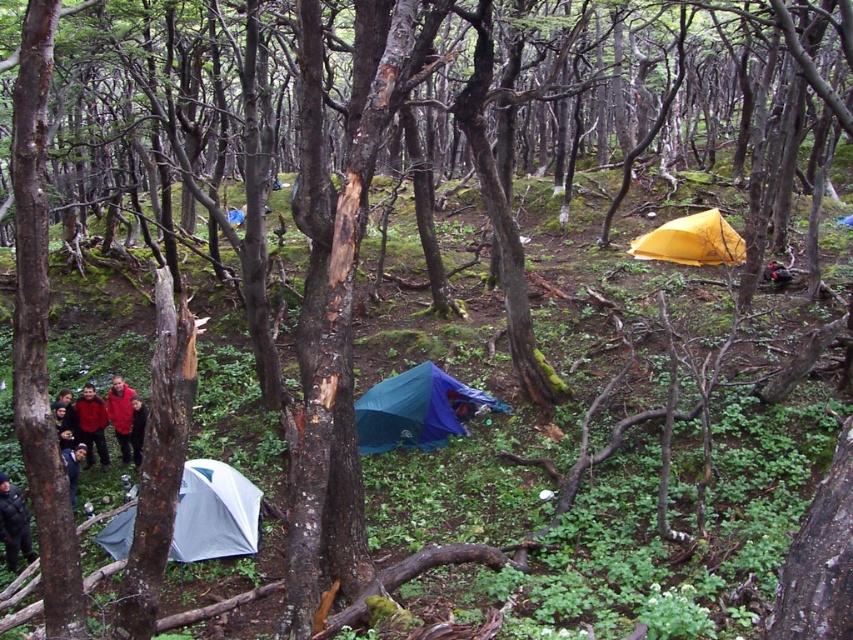
Is point (666, 230) less distant than point (16, 502)?

No, (666, 230) is behind (16, 502).

Which is more to the left, yellow matte tent at upper right or dark gray uniform at lower left?

dark gray uniform at lower left is more to the left.

Who is more forward, (648, 236) or (21, 508)?

Point (21, 508)

Locate an element on the screen. yellow matte tent at upper right is located at coordinates (691, 241).

Who is more forward, (200, 508) or (78, 401)?

Point (200, 508)

Does white fabric tent at lower left appear on the left side of red wool sweater at lower left?

In fact, white fabric tent at lower left is to the right of red wool sweater at lower left.

Between point (189, 548) and point (85, 442), which one is positioned behind?

The point (85, 442) is more distant.

Where is `white fabric tent at lower left`? white fabric tent at lower left is located at coordinates pos(213,513).

Where is `yellow matte tent at upper right`? This screenshot has width=853, height=640. yellow matte tent at upper right is located at coordinates (691, 241).

Does yellow matte tent at upper right have a greater width compared to red wool sweater at lower left?

Correct, the width of yellow matte tent at upper right exceeds that of red wool sweater at lower left.

Does point (675, 260) come closer to viewer compared to point (99, 410)?

No, (675, 260) is further to viewer.

Image resolution: width=853 pixels, height=640 pixels. Identify the location of yellow matte tent at upper right. (691, 241).